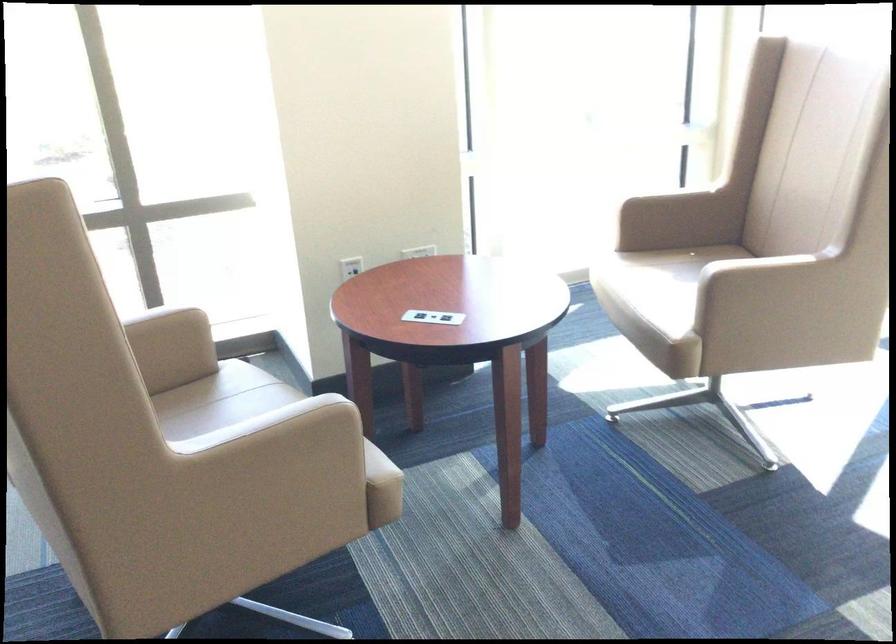
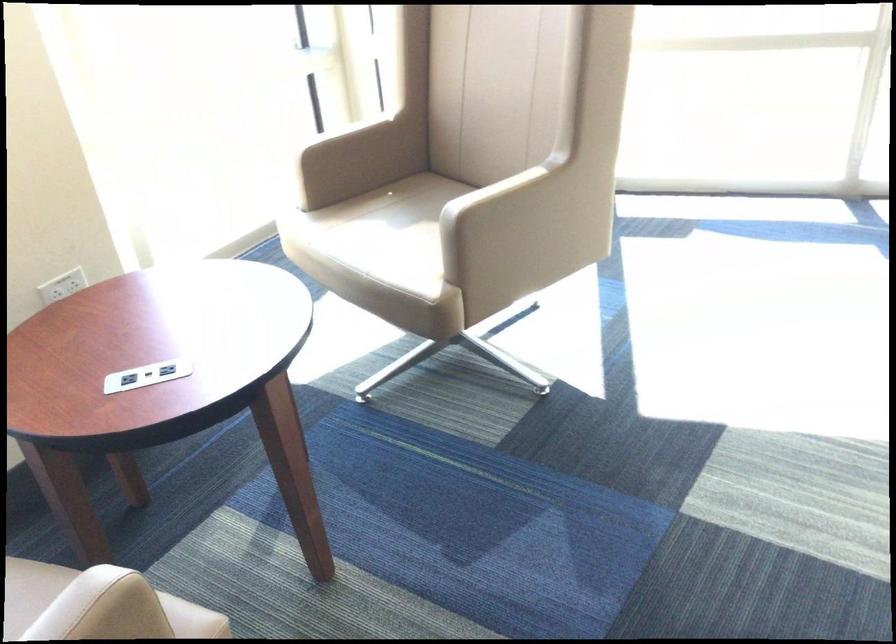
In the second image, find the point that corresponds to point (412, 252) in the first image.

(62, 286)